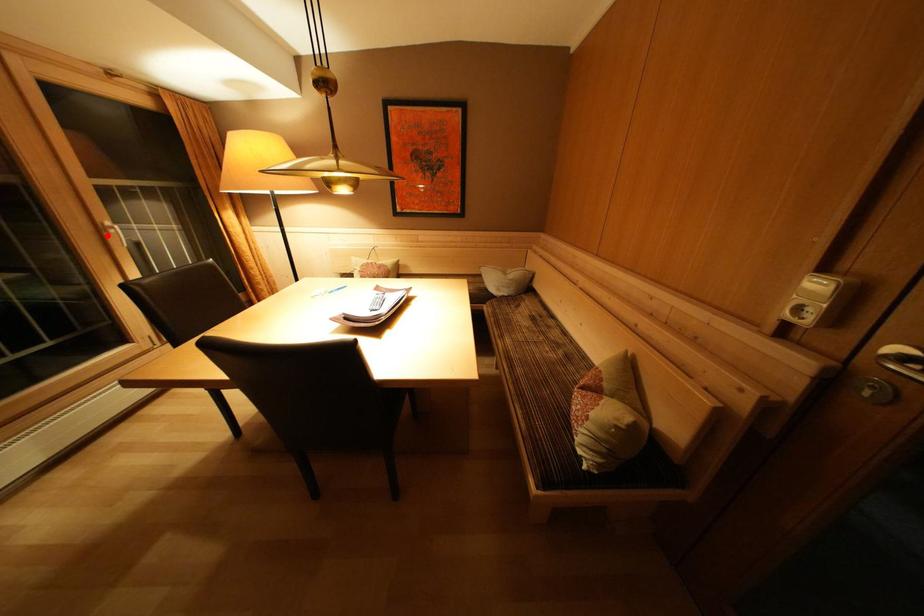
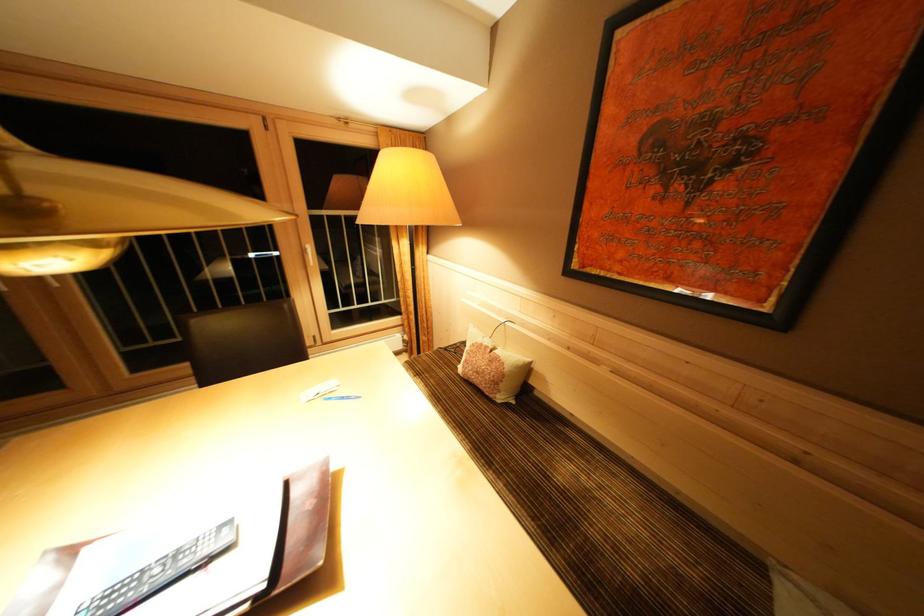
Where in the second image is the point corresponding to the highlighted location from the first image?

(310, 256)